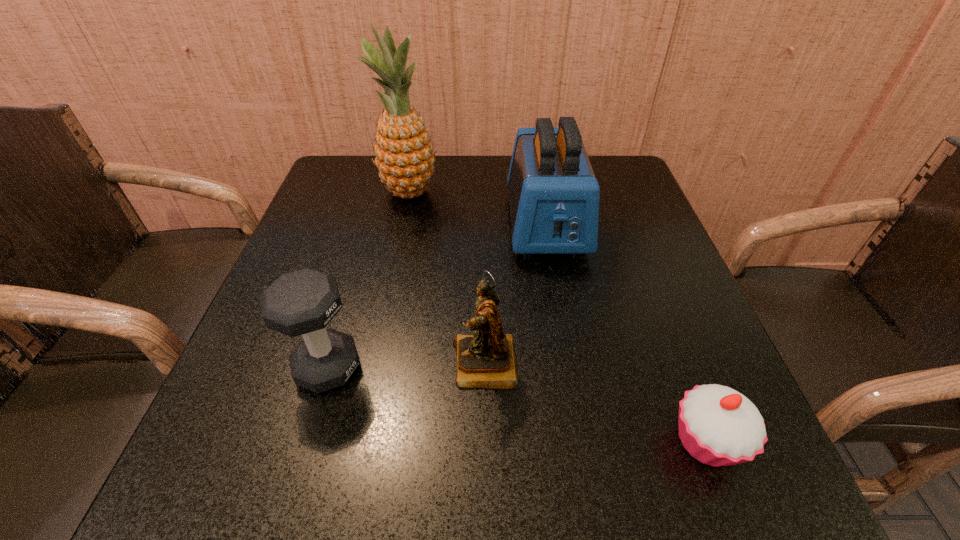
In order to click on vacant space that satisfies the following two spatial constraints: 1. on the front-facing side of the cupcake; 2. on the right side of the toaster in this screenshot , I will do `click(585, 442)`.

Identify the location of free region that satisfies the following two spatial constraints: 1. on the front-facing side of the nearest object; 2. on the left side of the toaster. This screenshot has width=960, height=540. (585, 442).